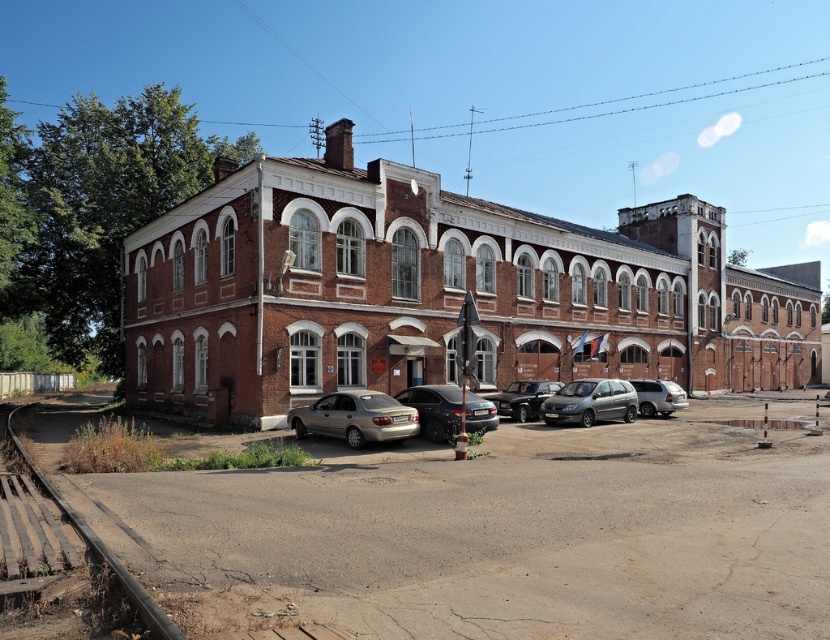
Question: Can you confirm if red brick building at center is thinner than satin black sedan at center?

Choices:
 (A) yes
 (B) no

Answer: (B)

Question: Is gold metallic sedan at center closer to the viewer compared to shiny silver sedan at center?

Choices:
 (A) yes
 (B) no

Answer: (A)

Question: Which of these objects is positioned farthest from the dirt track at lower left?

Choices:
 (A) slate metallic minivan at center
 (B) gold metallic sedan at center
 (C) brown wooden train track at lower left
 (D) shiny silver sedan at center

Answer: (D)

Question: Which object is farther from the camera taking this photo?

Choices:
 (A) satin black sedan at center
 (B) brown wooden train track at lower left
 (C) gold metallic sedan at center

Answer: (A)

Question: Is gold metallic sedan at center wider than brown wooden train track at lower left?

Choices:
 (A) no
 (B) yes

Answer: (A)

Question: Which object is positioned farthest from the shiny silver sedan at center?

Choices:
 (A) dirt track at lower left
 (B) gold metallic sedan at center
 (C) satin black sedan at center

Answer: (A)